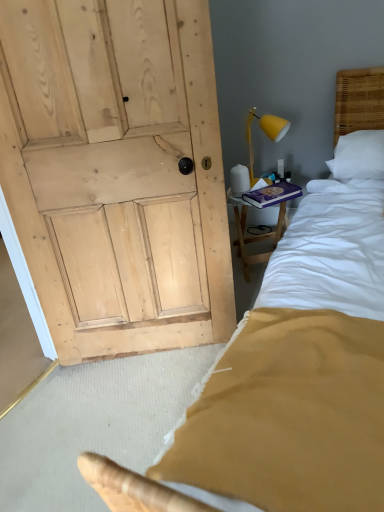
Question: Is purple hardcover book at upper right wider or thinner than yellow matte lamp at upper right?

Choices:
 (A) thin
 (B) wide

Answer: (B)

Question: Is purple hardcover book at upper right inside the boundaries of yellow matte lamp at upper right, or outside?

Choices:
 (A) inside
 (B) outside

Answer: (B)

Question: Considering the real-world distances, which object is farthest from the yellow matte lamp at upper right?

Choices:
 (A) purple hardcover book at upper right
 (B) wooden bedside table at right

Answer: (A)

Question: Which is nearer to the yellow matte lamp at upper right?

Choices:
 (A) purple hardcover book at upper right
 (B) wooden bedside table at right

Answer: (B)